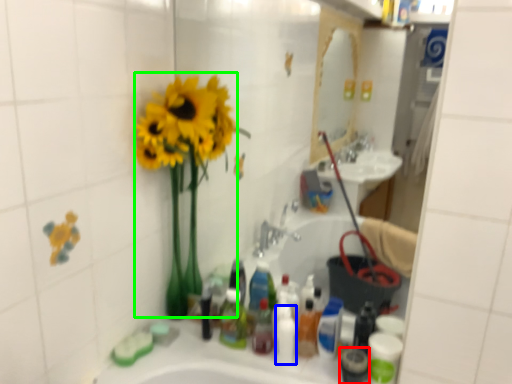
Question: Considering the real-world distances, which object is closest to mouthwash (highlighted by a red box)? toiletry (highlighted by a blue box) or floral arrangement (highlighted by a green box).

Choices:
 (A) toiletry
 (B) floral arrangement

Answer: (A)